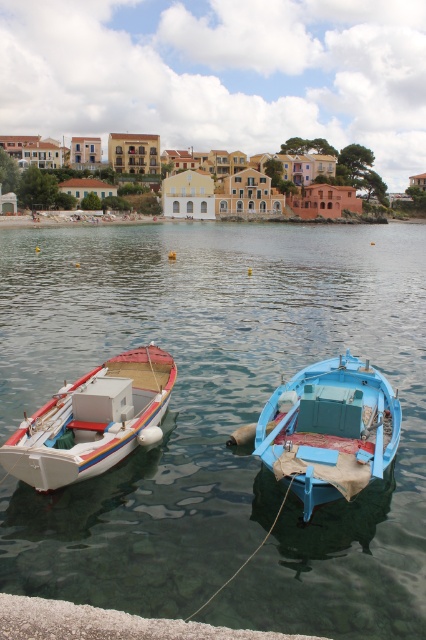
You are standing on the shore looking at the two boats. There is a point marked at coordinates (218, 420) in the image. Which object from the scene does this point most likely represent?

The point at coordinates (218, 420) corresponds to clear water at center.

You are standing on the shore looking at the two boats. Which boat, the blue painted wood boat at center or the white matte boat at left, is closer to you?

The blue painted wood boat at center is closer to you because it is in front of the white matte boat at left.